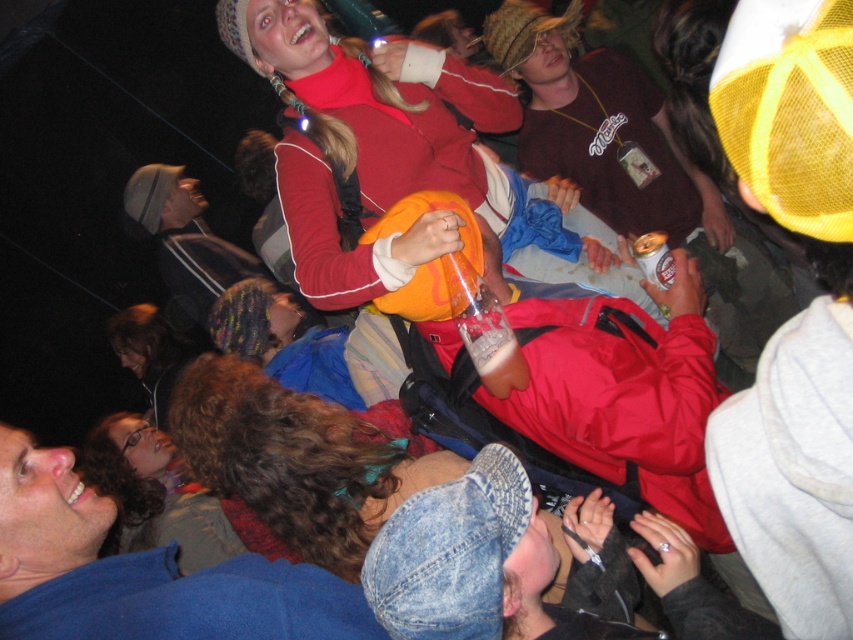
You are standing in the crowd at the concert. You see two points in the image, one at point (583, 112) and another at point (498, 349). Which point is closer to you?

Point (583, 112) is further to the camera than point (498, 349), so the point at (498, 349) is closer to you.

You are at the event and want to take a photo of the striped knit hat at upper center and the gold metallic can at center. Which object should you focus on first to ensure both are in the frame without moving the camera?

You should focus on the striped knit hat at upper center first because it is taller than the gold metallic can at center, so positioning the camera to include its full height will naturally include the shorter gold metallic can at center as well.